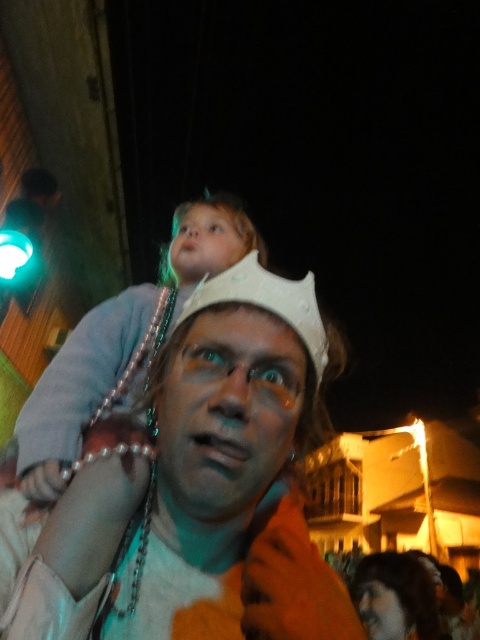
Between white pearl necklace at center and white matte crown at upper center, which one is positioned higher?

white matte crown at upper center

Can you confirm if white pearl necklace at center is bigger than white matte crown at upper center?

Correct, white pearl necklace at center is larger in size than white matte crown at upper center.

Who is more forward, (252, 461) or (188, 310)?

Point (252, 461)

Find the location of `white pearl necklace at center`. white pearl necklace at center is located at coordinates (191, 490).

Can you confirm if white matte crown at upper center is positioned above smooth white crown at upper center?

Actually, white matte crown at upper center is below smooth white crown at upper center.

Consider the image. Can you confirm if white matte crown at upper center is positioned below smooth white crown at upper center?

Yes, white matte crown at upper center is below smooth white crown at upper center.

Who is more distant from viewer, (271,312) or (262,257)?

Positioned behind is point (262,257).

This screenshot has width=480, height=640. I want to click on white matte crown at upper center, so click(x=257, y=307).

Is white pearl necklace at center bigger than dark brown hair at lower right?

No.

Is white pearl necklace at center above dark brown hair at lower right?

Yes, white pearl necklace at center is above dark brown hair at lower right.

Locate an element on the screen. Image resolution: width=480 pixels, height=640 pixels. white pearl necklace at center is located at coordinates (191, 490).